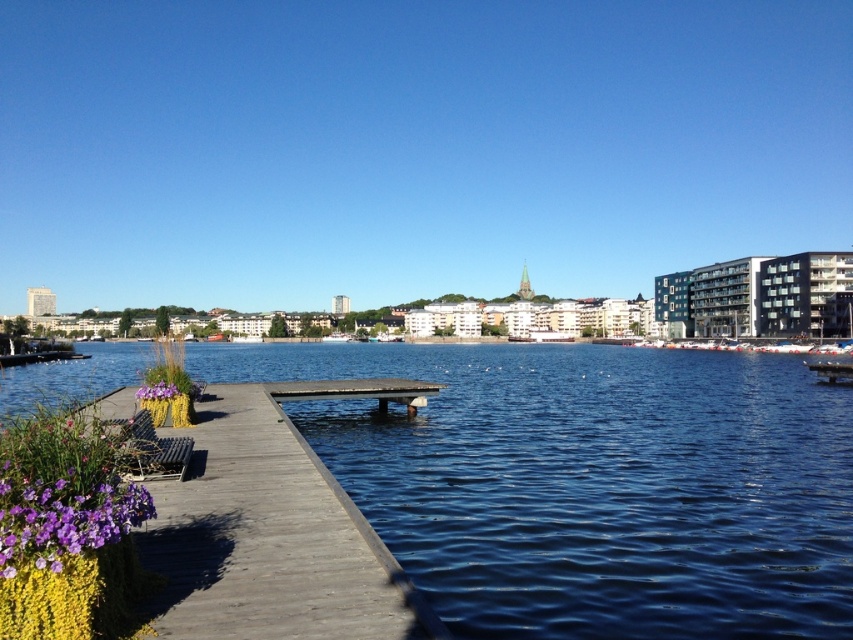
Question: From the image, what is the correct spatial relationship of blue water at center in relation to purple matte flowers at lower left?

Choices:
 (A) above
 (B) below

Answer: (B)

Question: Is blue water at center above purple matte flowers at lower left?

Choices:
 (A) no
 (B) yes

Answer: (A)

Question: Which point is farther to the camera?

Choices:
 (A) (405, 392)
 (B) (334, 595)
 (C) (15, 547)

Answer: (A)

Question: Which object is the closest to the purple matte flower at lower left?

Choices:
 (A) purple matte flowers at lower left
 (B) blue water at center
 (C) wooden picnic table at center
 (D) wooden dock at lower left

Answer: (D)

Question: Where is purple matte flowers at lower left located in relation to purple matte flower at lower left in the image?

Choices:
 (A) left
 (B) right

Answer: (B)

Question: Which point is farther to the camera?

Choices:
 (A) wooden picnic table at center
 (B) wooden dock at lower left

Answer: (A)